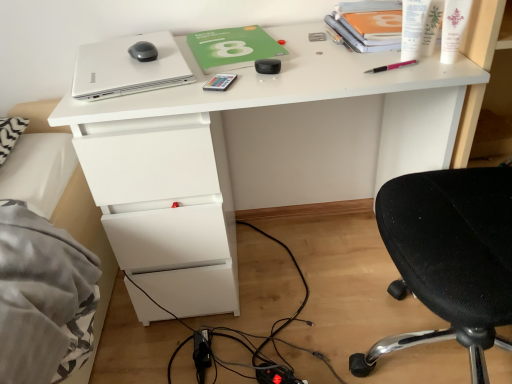
The image size is (512, 384). I want to click on free space between metallic rectangular object at center, the 1th stationery in the left-to-right sequence, and white plastic pen at upper right, the 3th stationery when ordered from left to right, so click(x=307, y=73).